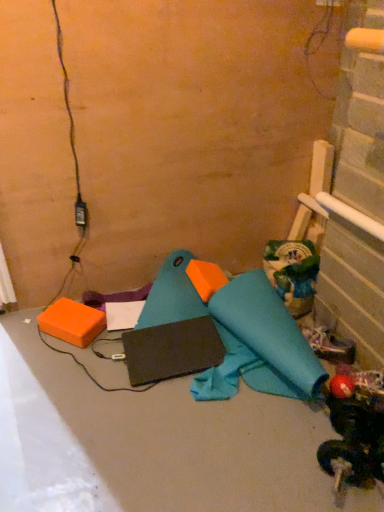
Question: Can you confirm if white fabric shoe at lower right is positioned to the right of orange foam block at lower left?

Choices:
 (A) no
 (B) yes

Answer: (B)

Question: Is white fabric shoe at lower right further to the viewer compared to orange foam block at lower left?

Choices:
 (A) no
 (B) yes

Answer: (A)

Question: Can you confirm if white fabric shoe at lower right is taller than orange foam block at lower left?

Choices:
 (A) yes
 (B) no

Answer: (A)

Question: Considering the relative sizes of white fabric shoe at lower right and orange foam block at lower left in the image provided, is white fabric shoe at lower right bigger than orange foam block at lower left?

Choices:
 (A) yes
 (B) no

Answer: (B)

Question: From the image's perspective, is white fabric shoe at lower right on orange foam block at lower left?

Choices:
 (A) no
 (B) yes

Answer: (A)

Question: Could you tell me if white fabric shoe at lower right is facing orange foam block at lower left?

Choices:
 (A) no
 (B) yes

Answer: (A)

Question: Are rubberized red ball at lower right, which is the second toy from back to front, and orange foam block at lower left located far from each other?

Choices:
 (A) no
 (B) yes

Answer: (A)

Question: Is rubberized red ball at lower right, which appears as the first toy when ordered from the bottom, at the left side of orange foam block at lower left?

Choices:
 (A) no
 (B) yes

Answer: (A)

Question: Could you tell me if rubberized red ball at lower right, which is the 2th toy in top-to-bottom order, is facing orange foam block at lower left?

Choices:
 (A) no
 (B) yes

Answer: (B)

Question: Can you confirm if rubberized red ball at lower right, acting as the first toy starting from the front, is taller than orange foam block at lower left?

Choices:
 (A) yes
 (B) no

Answer: (A)

Question: Can you confirm if rubberized red ball at lower right, which is the second toy from back to front, is thinner than orange foam block at lower left?

Choices:
 (A) yes
 (B) no

Answer: (B)

Question: From a real-world perspective, is rubberized red ball at lower right, which appears as the first toy when ordered from the bottom, over orange foam block at lower left?

Choices:
 (A) yes
 (B) no

Answer: (A)

Question: Is orange foam block at lower left behind rubberized red ball at lower right, which is the 2th toy in top-to-bottom order?

Choices:
 (A) no
 (B) yes

Answer: (B)